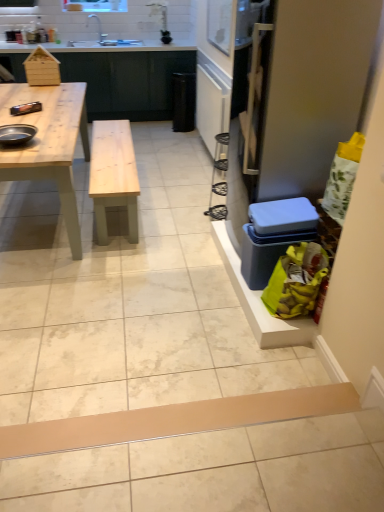
Find the location of a particular element. vacant area on top of brown cardboard plank at lower center (from a real-world perspective) is located at coordinates (207, 417).